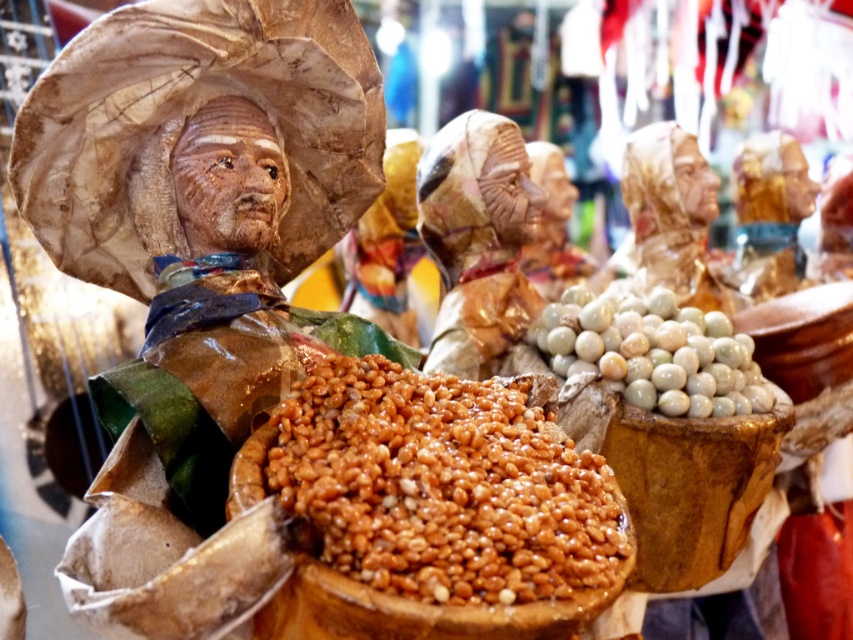
Can you confirm if brown glossy grain at center is thinner than matte brown statue at center?

In fact, brown glossy grain at center might be wider than matte brown statue at center.

Does brown glossy grain at center appear on the right side of matte brown statue at center?

Incorrect, brown glossy grain at center is not on the right side of matte brown statue at center.

The image size is (853, 640). In order to click on brown glossy grain at center in this screenshot , I will do `click(442, 486)`.

Measure the distance between brown glossy grain at center and camera.

A distance of 88.36 centimeters exists between brown glossy grain at center and camera.

Does brown glossy grain at center appear on the right side of white marble beads at center?

No, brown glossy grain at center is not to the right of white marble beads at center.

Where is `brown glossy grain at center`? The image size is (853, 640). brown glossy grain at center is located at coordinates (442, 486).

Image resolution: width=853 pixels, height=640 pixels. Find the location of `brown glossy grain at center`. brown glossy grain at center is located at coordinates (442, 486).

Who is taller, matte brown statue at center or white marble beads at center?

matte brown statue at center

From the picture: Who is shorter, matte brown statue at center or white marble beads at center?

With less height is white marble beads at center.

Image resolution: width=853 pixels, height=640 pixels. Describe the element at coordinates (477, 237) in the screenshot. I see `matte brown statue at center` at that location.

Locate an element on the screen. matte brown statue at center is located at coordinates (477, 237).